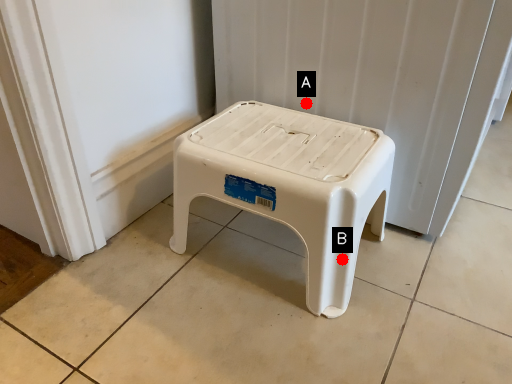
Question: Two points are circled on the image, labeled by A and B beside each circle. Which point is closer to the camera?

Choices:
 (A) A is closer
 (B) B is closer

Answer: (B)